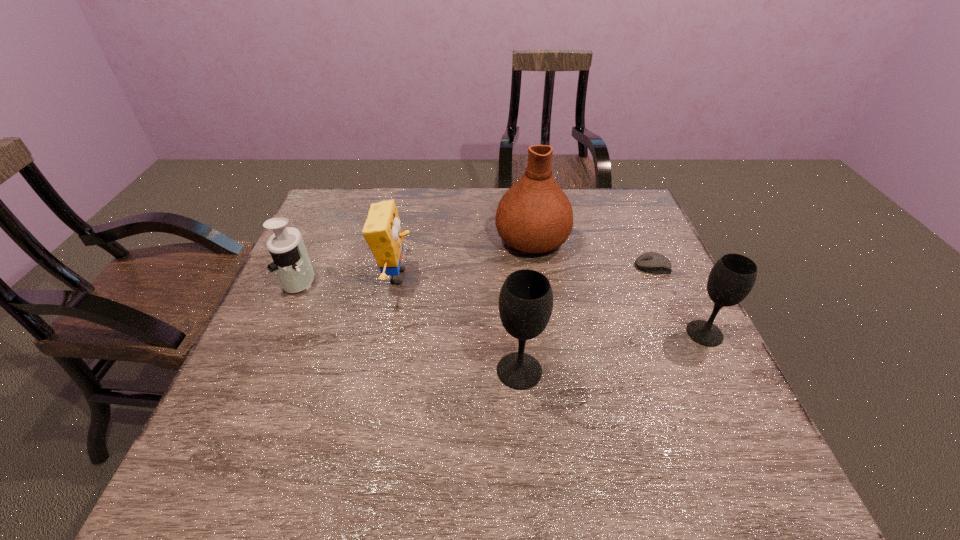
You are a GUI agent. You are given a task and a screenshot of the screen. Output one action in this format:
    pyautogui.click(x=<x>, y=<y>)
    Task: Click on the empty space between the pitcher and the sponge
    This screenshot has width=960, height=540.
    Given the screenshot: What is the action you would take?
    pyautogui.click(x=465, y=258)

At what (x,y) coordinates should I click in order to perform the action: click on free space between the shorter wineglass and the pitcher. Please return your answer as a coordinate pair (x, y). Image resolution: width=960 pixels, height=540 pixels. Looking at the image, I should click on (618, 286).

The width and height of the screenshot is (960, 540). I want to click on free space between the fifth object from right to left and the pitcher, so click(x=465, y=258).

Where is `object that is the second closest to the left wineglass`? object that is the second closest to the left wineglass is located at coordinates (534, 216).

At what (x,y) coordinates should I click in order to perform the action: click on object that is the third closest one to the pitcher. Please return your answer as a coordinate pair (x, y). Looking at the image, I should click on (733, 276).

I want to click on vacant space that satisfies the following two spatial constraints: 1. on the back side of the nearer wineglass; 2. on the left side of the right wineglass, so click(x=516, y=333).

Identify the location of vacant space that satisfies the following two spatial constraints: 1. on the face of the sponge; 2. on the front side of the leftmost object. The height and width of the screenshot is (540, 960). (396, 280).

This screenshot has height=540, width=960. I want to click on free space that satisfies the following two spatial constraints: 1. on the back side of the second tallest object; 2. on the face of the sponge, so click(512, 277).